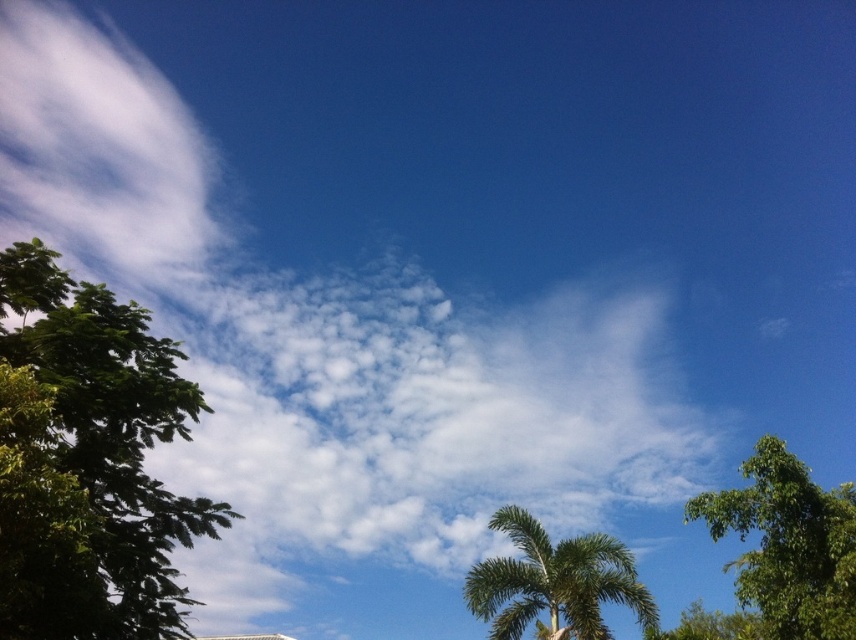
Question: Which point is closer to the camera?

Choices:
 (A) (753, 452)
 (B) (129, 376)
 (C) (507, 570)

Answer: (B)

Question: Among these points, which one is farthest from the camera?

Choices:
 (A) (528, 572)
 (B) (789, 483)
 (C) (31, 307)

Answer: (A)

Question: In this image, where is green leafy tree at left located relative to green leafy palm tree at center?

Choices:
 (A) above
 (B) below

Answer: (A)

Question: Can you confirm if green leafy tree at left is positioned to the left of green leafy palm tree at center?

Choices:
 (A) no
 (B) yes

Answer: (B)

Question: Is green leafy tree at left to the right of green leafy tree at right from the viewer's perspective?

Choices:
 (A) no
 (B) yes

Answer: (A)

Question: Estimate the real-world distances between objects in this image. Which object is farther from the green leafy tree at left?

Choices:
 (A) green leafy palm tree at center
 (B) green leafy tree at right

Answer: (B)